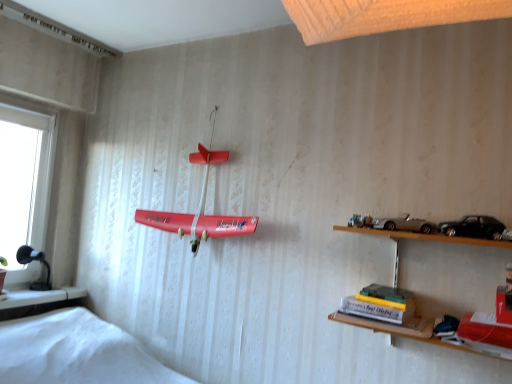
Question: Is hardcover book at lower right next to silver metallic toy car at upper right, arranged as the second toy car when viewed from the right?

Choices:
 (A) no
 (B) yes

Answer: (A)

Question: From a real-world perspective, is hardcover book at lower right on top of silver metallic toy car at upper right, placed as the 1th toy car when sorted from back to front?

Choices:
 (A) no
 (B) yes

Answer: (A)

Question: Considering the relative sizes of hardcover book at lower right and silver metallic toy car at upper right, the 2th toy car from the front, in the image provided, is hardcover book at lower right bigger than silver metallic toy car at upper right, the 2th toy car from the front,?

Choices:
 (A) yes
 (B) no

Answer: (A)

Question: Is hardcover book at lower right positioned far away from silver metallic toy car at upper right, which is the 1th toy car from left to right?

Choices:
 (A) no
 (B) yes

Answer: (A)

Question: Does hardcover book at lower right have a lesser width compared to silver metallic toy car at upper right, which is the 1th toy car from left to right?

Choices:
 (A) no
 (B) yes

Answer: (A)

Question: From the image's perspective, is black plastic lamp at lower left positioned above or below black matte toy car at upper right, which appears as the 2th toy car when viewed from the back?

Choices:
 (A) below
 (B) above

Answer: (A)

Question: Looking at their shapes, would you say black plastic lamp at lower left is wider or thinner than black matte toy car at upper right, the 1th toy car when ordered from right to left?

Choices:
 (A) wide
 (B) thin

Answer: (B)

Question: Relative to black matte toy car at upper right, acting as the 1th toy car starting from the front, is black plastic lamp at lower left in front or behind?

Choices:
 (A) front
 (B) behind

Answer: (B)

Question: From a real-world perspective, is black plastic lamp at lower left physically located above or below black matte toy car at upper right, the 1th toy car when ordered from right to left?

Choices:
 (A) above
 (B) below

Answer: (B)

Question: In terms of height, does hardcover book at lower right look taller or shorter compared to black plastic lamp at lower left?

Choices:
 (A) tall
 (B) short

Answer: (B)

Question: Do you think hardcover book at lower right is within black plastic lamp at lower left, or outside of it?

Choices:
 (A) inside
 (B) outside

Answer: (B)

Question: Is hardcover book at lower right bigger or smaller than black plastic lamp at lower left?

Choices:
 (A) small
 (B) big

Answer: (B)

Question: Does point pyautogui.click(x=372, y=314) appear closer or farther from the camera than point pyautogui.click(x=44, y=289)?

Choices:
 (A) farther
 (B) closer

Answer: (B)

Question: Considering the positions of point (490, 231) and point (25, 251), is point (490, 231) closer or farther from the camera than point (25, 251)?

Choices:
 (A) farther
 (B) closer

Answer: (B)

Question: In terms of size, does black matte toy car at upper right, which appears as the second toy car when viewed from the left, appear bigger or smaller than black plastic lamp at lower left?

Choices:
 (A) big
 (B) small

Answer: (B)